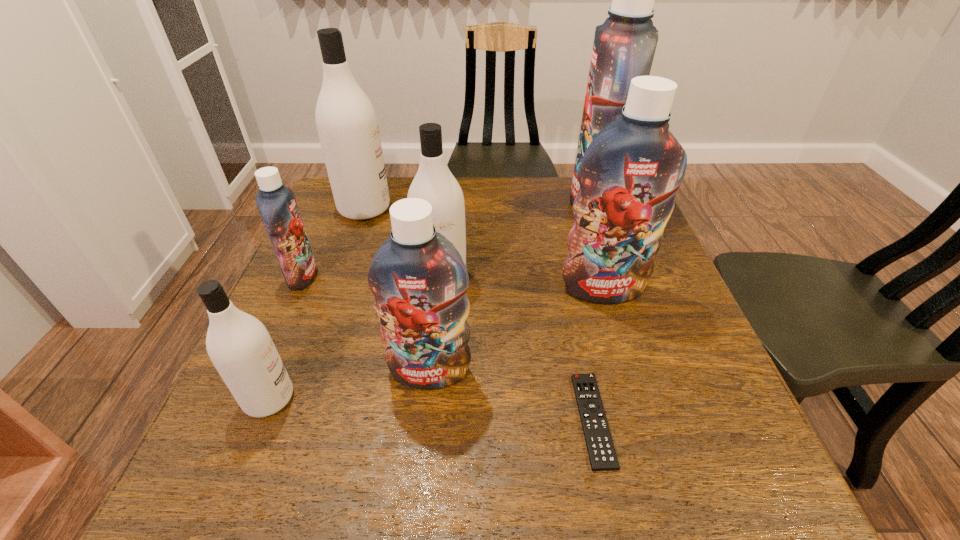
The image size is (960, 540). I want to click on vacant position in the image that satisfies the following two spatial constraints: 1. on the front label of the shortest object; 2. on the right side of the second smallest blue shampoo, so click(x=425, y=420).

Locate an element on the screen. vacant region that satisfies the following two spatial constraints: 1. on the back side of the shortest object; 2. on the front-facing side of the nearest white shampoo is located at coordinates pos(588,398).

The height and width of the screenshot is (540, 960). In order to click on vacant area in the image that satisfies the following two spatial constraints: 1. on the back side of the shortest object; 2. on the front label of the smallest blue shampoo in this screenshot , I will do `click(564, 276)`.

The image size is (960, 540). Find the location of `vacant area that satisfies the following two spatial constraints: 1. on the front-facing side of the remote control; 2. on the left side of the nearest white shampoo`. vacant area that satisfies the following two spatial constraints: 1. on the front-facing side of the remote control; 2. on the left side of the nearest white shampoo is located at coordinates (260, 420).